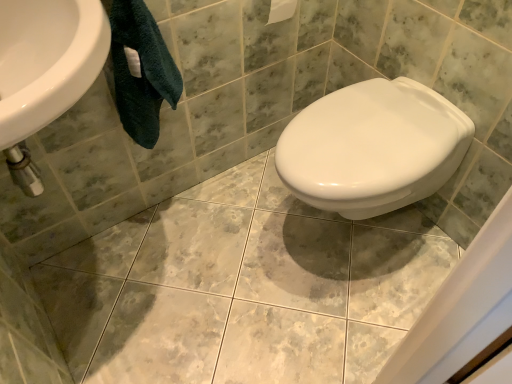
You are a GUI agent. You are given a task and a screenshot of the screen. Output one action in this format:
    pyautogui.click(x=<x>, y=<y>)
    Task: Click on the dark green towel at upper left
    
    Given the screenshot: What is the action you would take?
    click(x=141, y=71)

What do you see at coordinates (141, 71) in the screenshot? I see `dark green towel at upper left` at bounding box center [141, 71].

Identify the location of dark green towel at upper left. (141, 71).